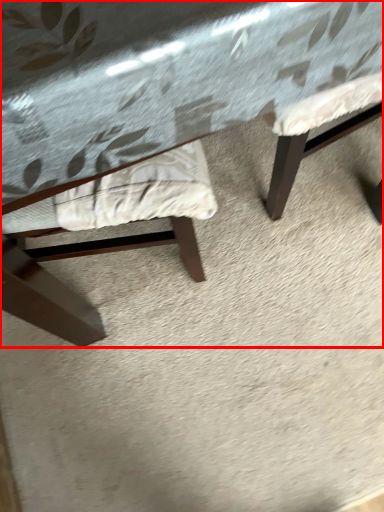
Question: Where is table (annotated by the red box) located in relation to chair in the image?

Choices:
 (A) left
 (B) right

Answer: (B)